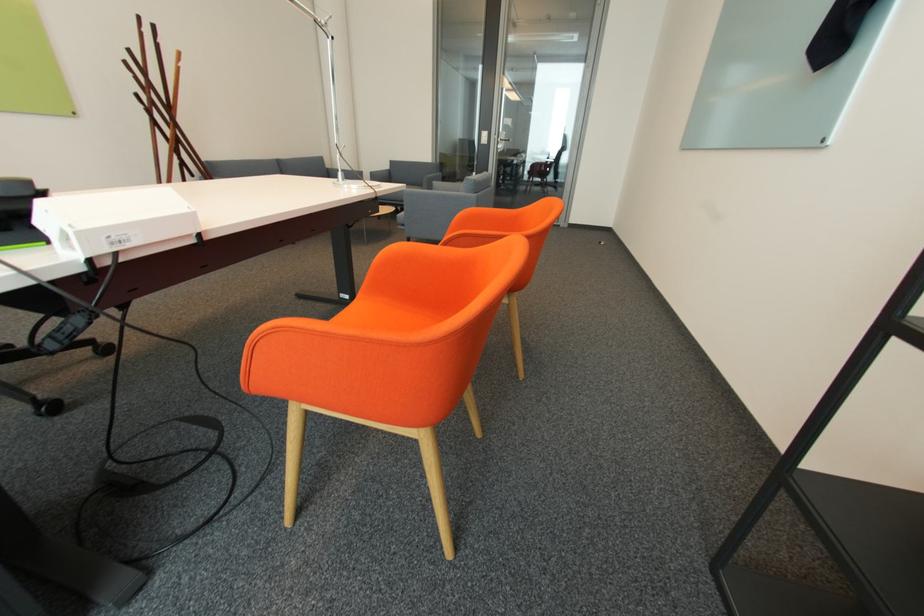
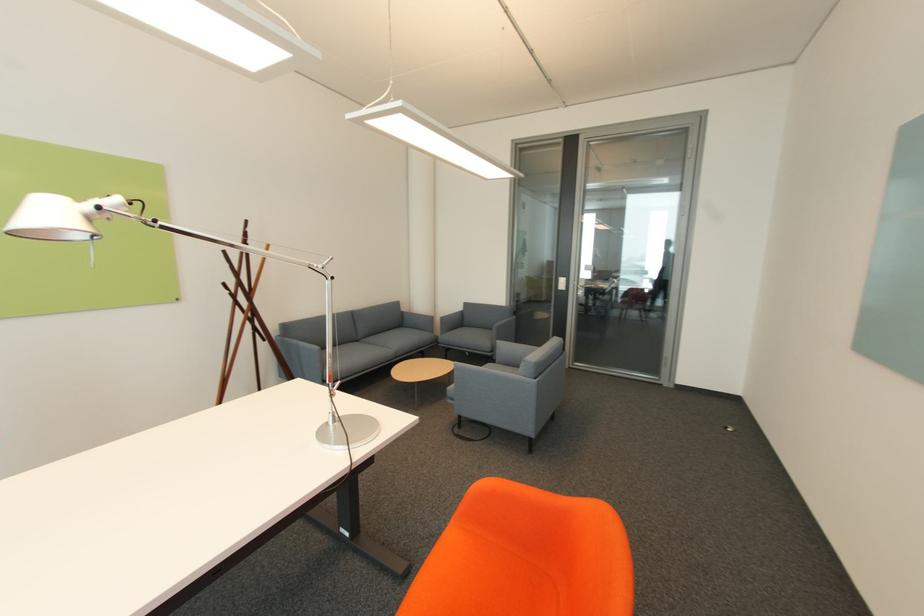
The first image is from the beginning of the video and the second image is from the end. How did the camera likely rotate when shooting the video?

The camera's rotation is toward left-up.